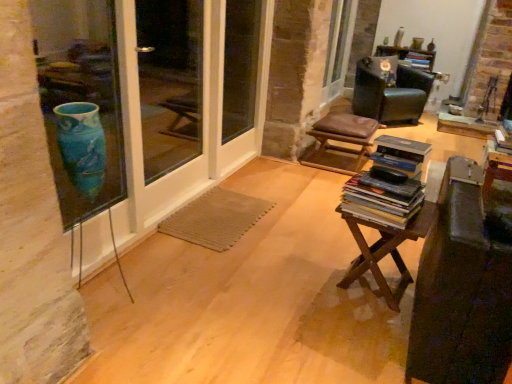
Question: Does wooden at center appear on the right side of clear glass screen door at left?

Choices:
 (A) no
 (B) yes

Answer: (B)

Question: Considering the relative sizes of wooden at center and clear glass screen door at left in the image provided, is wooden at center shorter than clear glass screen door at left?

Choices:
 (A) yes
 (B) no

Answer: (A)

Question: Is wooden at center at the left side of clear glass screen door at left?

Choices:
 (A) no
 (B) yes

Answer: (A)

Question: From a real-world perspective, is wooden at center below clear glass screen door at left?

Choices:
 (A) yes
 (B) no

Answer: (A)

Question: Does wooden at center come behind clear glass screen door at left?

Choices:
 (A) yes
 (B) no

Answer: (B)

Question: From the image's perspective, is blue glass vase at left above or below hardcover books at center, which ranks as the 2th book in right-to-left order?

Choices:
 (A) above
 (B) below

Answer: (A)

Question: Visually, is blue glass vase at left positioned to the left or to the right of hardcover books at center, which ranks as the 2th book in right-to-left order?

Choices:
 (A) right
 (B) left

Answer: (B)

Question: Considering the positions of blue glass vase at left and hardcover books at center, which ranks as the 1th book in front-to-back order, in the image, is blue glass vase at left wider or thinner than hardcover books at center, which ranks as the 1th book in front-to-back order,?

Choices:
 (A) wide
 (B) thin

Answer: (B)

Question: Looking at the image, does blue glass vase at left seem bigger or smaller compared to hardcover books at center, which appears as the first book when ordered from the bottom?

Choices:
 (A) big
 (B) small

Answer: (A)

Question: In terms of width, does hardcover books at center, which is counted as the second book, starting from the back, look wider or thinner when compared to brown leather stool at center?

Choices:
 (A) thin
 (B) wide

Answer: (A)

Question: Is point (398, 170) positioned closer to the camera than point (346, 137)?

Choices:
 (A) closer
 (B) farther

Answer: (A)

Question: In the image, is hardcover books at center, which is counted as the second book, starting from the back, on the left side or the right side of brown leather stool at center?

Choices:
 (A) left
 (B) right

Answer: (A)

Question: Considering the positions of hardcover books at center, which is the 1th book in left-to-right order, and brown leather stool at center in the image, is hardcover books at center, which is the 1th book in left-to-right order, bigger or smaller than brown leather stool at center?

Choices:
 (A) big
 (B) small

Answer: (B)

Question: Is hardcover book at upper right, which appears as the 2th book when viewed from the front, taller or shorter than hardcover books at center, which ranks as the 1th book in front-to-back order?

Choices:
 (A) short
 (B) tall

Answer: (B)

Question: Considering the positions of hardcover book at upper right, which is counted as the 1th book, starting from the back, and hardcover books at center, which ranks as the 1th book in front-to-back order, in the image, is hardcover book at upper right, which is counted as the 1th book, starting from the back, wider or thinner than hardcover books at center, which ranks as the 1th book in front-to-back order,?

Choices:
 (A) wide
 (B) thin

Answer: (B)